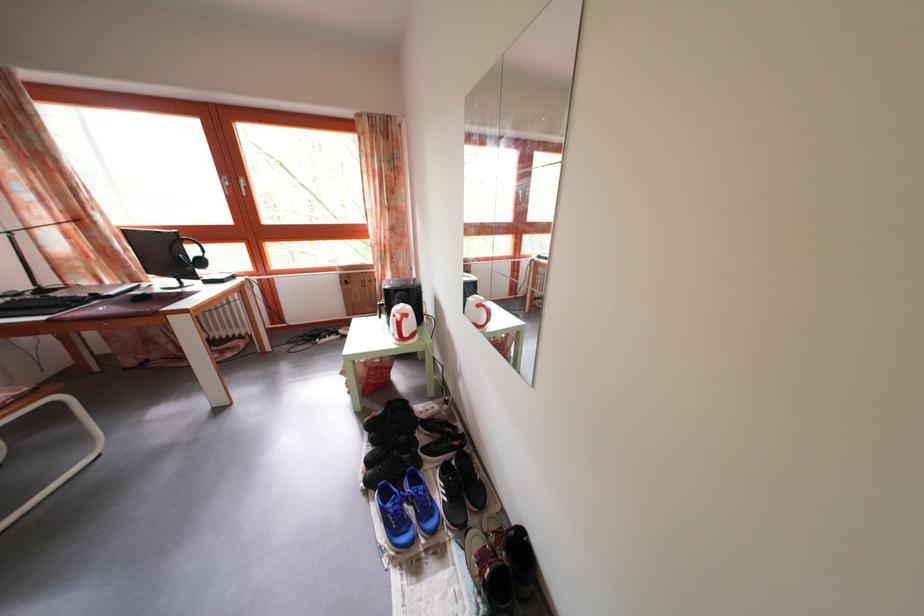
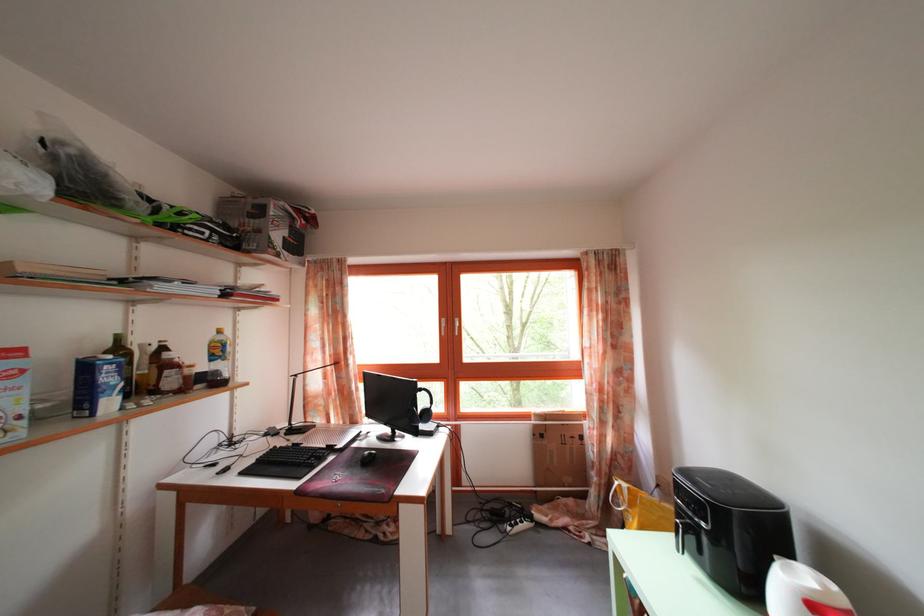
In the second image, find the point that corresponds to (x=57, y=314) in the first image.

(307, 472)